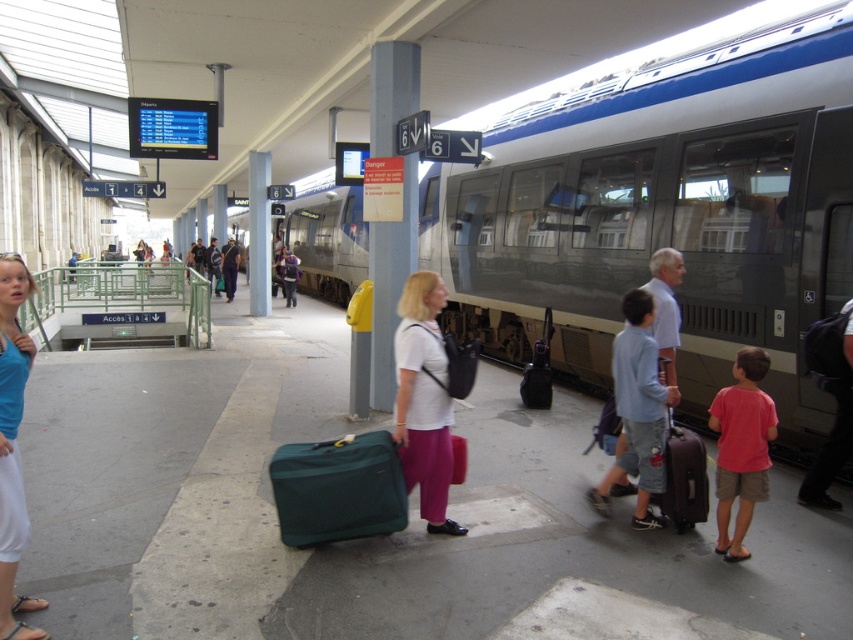
Is matte brown suitcase at center bigger than purple fabric backpack at center?

Actually, matte brown suitcase at center might be smaller than purple fabric backpack at center.

Between matte brown suitcase at center and purple fabric backpack at center, which one has more height?

purple fabric backpack at center

Between point (662, 497) and point (283, 250), which one is positioned behind?

The point (283, 250) is more distant.

The height and width of the screenshot is (640, 853). I want to click on matte brown suitcase at center, so click(683, 477).

Does green fabric suitcase at center have a greater width compared to metallic gray pillar at center?

Correct, the width of green fabric suitcase at center exceeds that of metallic gray pillar at center.

Does green fabric suitcase at center appear under metallic gray pillar at center?

Correct, green fabric suitcase at center is located below metallic gray pillar at center.

Does point (276, 451) come farther from viewer compared to point (370, 342)?

No, (276, 451) is in front of (370, 342).

Where is `green fabric suitcase at center`? The width and height of the screenshot is (853, 640). green fabric suitcase at center is located at coordinates (338, 490).

Does blue cotton tank top at lower left appear on the right side of matte brown suitcase at center?

Incorrect, blue cotton tank top at lower left is not on the right side of matte brown suitcase at center.

At what (x,y) coordinates should I click in order to perform the action: click on blue cotton tank top at lower left. Please return your answer as a coordinate pair (x, y). Looking at the image, I should click on (12, 445).